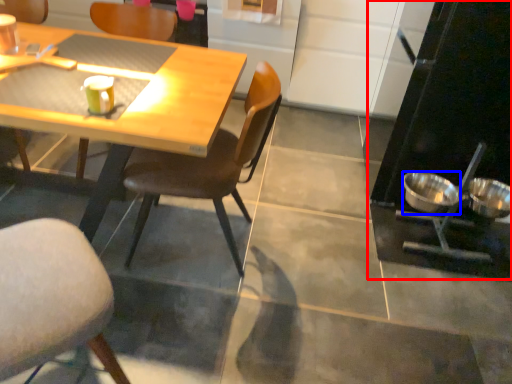
Question: Which point is further to the camera, appliance (highlighted by a red box) or bowl (highlighted by a blue box)?

Choices:
 (A) appliance
 (B) bowl

Answer: (B)